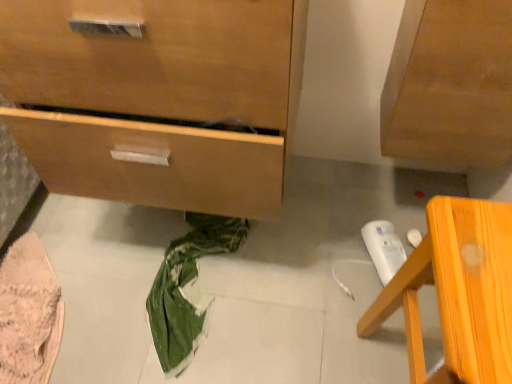
Question: Considering the positions of point (119, 147) and point (410, 279), is point (119, 147) closer or farther from the camera than point (410, 279)?

Choices:
 (A) closer
 (B) farther

Answer: (B)

Question: From a real-world perspective, is wooden chest of drawers at lower left above or below orange wood chair at lower right?

Choices:
 (A) below
 (B) above

Answer: (B)

Question: Which is nearer to the pink knitted fabric at lower left?

Choices:
 (A) wooden chest of drawers at lower left
 (B) orange wood chair at lower right

Answer: (A)

Question: Based on their relative distances, which object is farther from the pink knitted fabric at lower left?

Choices:
 (A) orange wood chair at lower right
 (B) wooden chest of drawers at lower left

Answer: (A)